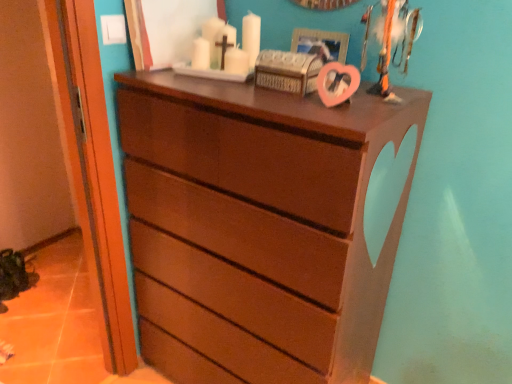
Where is `free spot above matte brown chest of drawers at center (from a real-world perspective)`? free spot above matte brown chest of drawers at center (from a real-world perspective) is located at coordinates (257, 84).